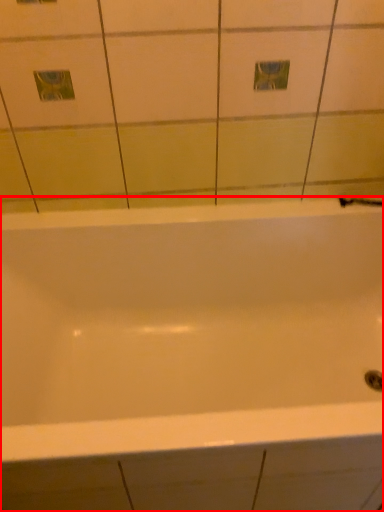
Question: Where is bathtub (annotated by the red box) located in relation to shower in the image?

Choices:
 (A) right
 (B) left

Answer: (B)